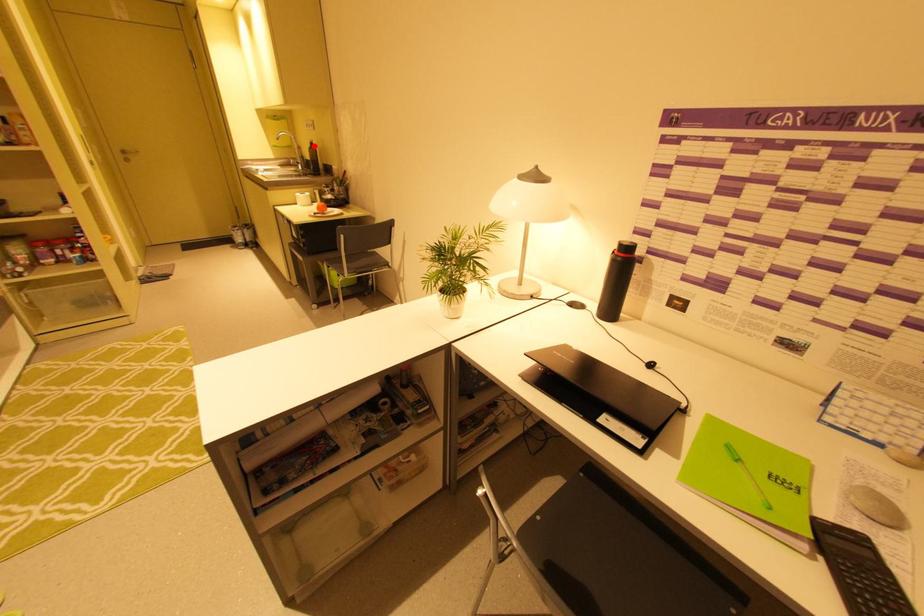
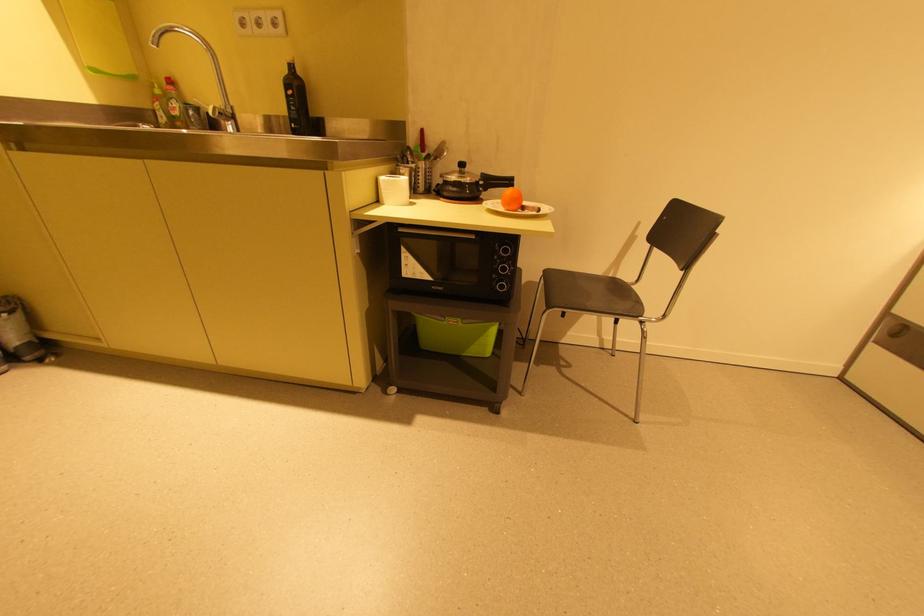
Where in the second image is the point corresponding to the highlighted location from the first image?

(289, 71)